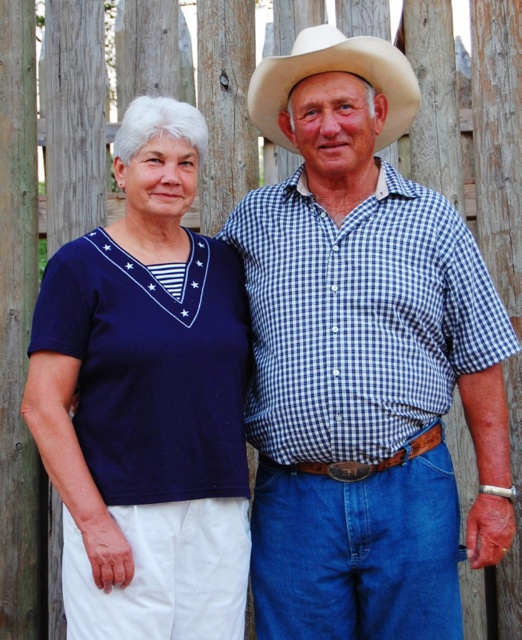
You are a photographer trying to capture both the navy blue fabric shirt at left and the white felt cowboy hat at upper center in a single frame. Since you want to ensure both are clearly visible, which object should you focus on first to account for their sizes?

The navy blue fabric shirt at left is bigger than the white felt cowboy hat at upper center, so you should focus on the navy blue fabric shirt at left first to ensure its details are sharp before adjusting for the smaller object.

You are standing in a rural area with two people near a wooden fence. You need to locate two specific points marked on the ground. The first point is at coordinates point (467, 236) and the second is at point (100, 323). From the perspective of someone facing the fence, which point is closer to the fence?

Point (467, 236) is behind point (100, 323), so the point closer to the fence is point (100, 323).

You are a photographer positioned at the center of the image. You want to ensure both the navy blue fabric shirt at left and the light colored cowboy hat at right are clearly visible in your photo. Which object is closer to the center of the image?

The navy blue fabric shirt at left is closer to the center of the image because it is located at point (147, 401), which is nearer to the center coordinates than the light colored cowboy hat at right.